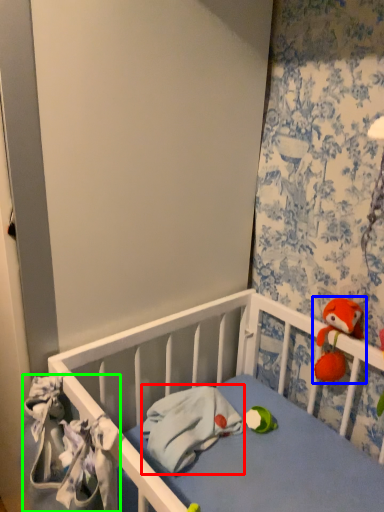
Question: Estimate the real-world distances between objects in this image. Which object is farther from material (highlighted by a red box), toy (highlighted by a blue box) or material (highlighted by a green box)?

Choices:
 (A) toy
 (B) material

Answer: (A)